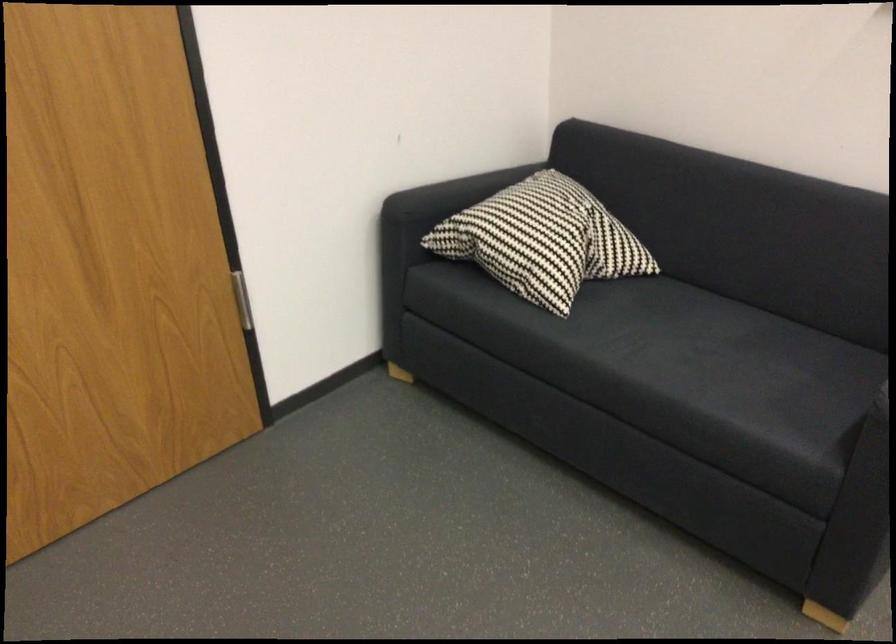
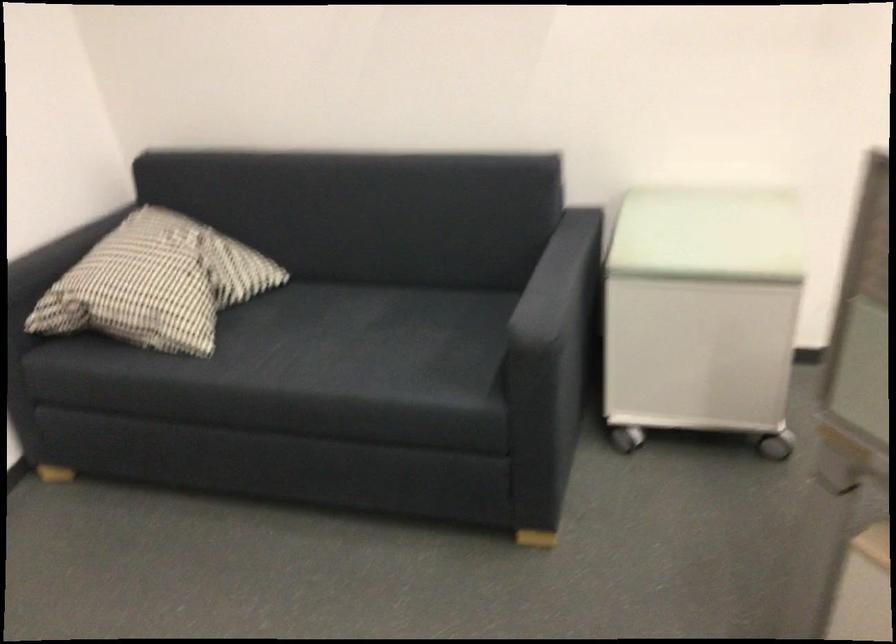
In the second image, find the point that corresponds to (762,353) in the first image.

(410, 327)